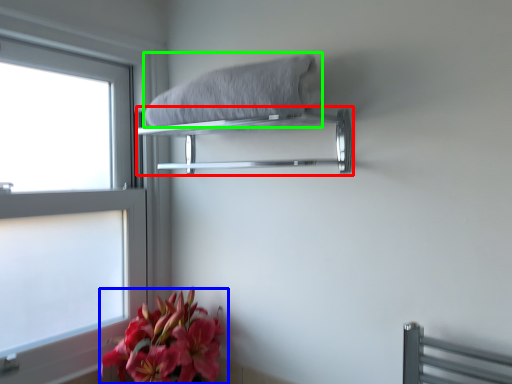
Question: Based on their relative distances, which object is nearer to balustrade (highlighted by a red box)? Choose from flower (highlighted by a blue box) and bath towel (highlighted by a green box).

Choices:
 (A) flower
 (B) bath towel

Answer: (B)